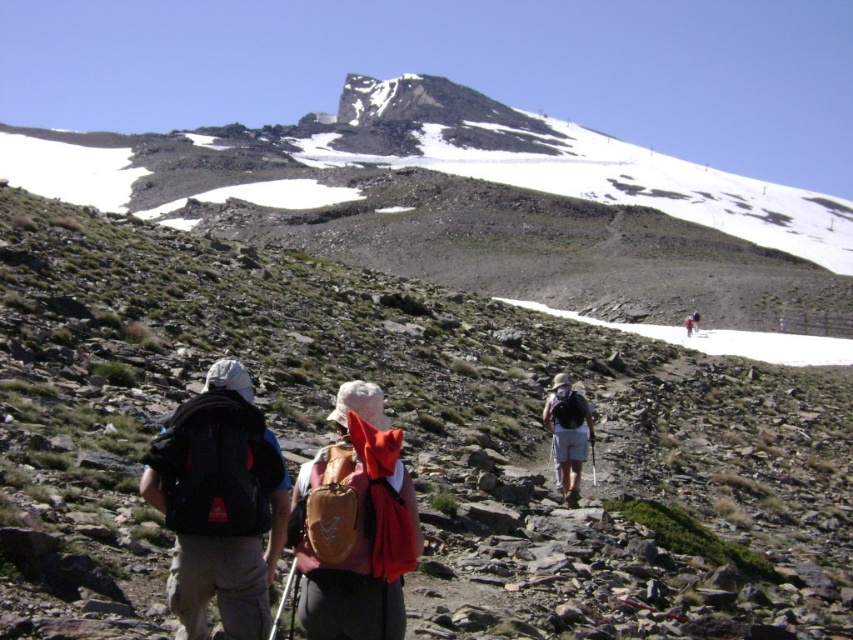
Which of these two, brown fabric backpack at center or matte orange backpack at center, stands shorter?

matte orange backpack at center

Can you confirm if brown fabric backpack at center is positioned below matte orange backpack at center?

No, brown fabric backpack at center is not below matte orange backpack at center.

Is point (312, 612) closer to camera compared to point (573, 404)?

Yes, point (312, 612) is in front of point (573, 404).

The image size is (853, 640). I want to click on brown fabric backpack at center, so click(358, 525).

Which is more to the left, snowy rock at upper center or matte orange backpack at center?

snowy rock at upper center

Is snowy rock at upper center bigger than matte orange backpack at center?

Indeed, snowy rock at upper center has a larger size compared to matte orange backpack at center.

Is point (3, 154) positioned before point (561, 408)?

No, it is not.

Identify the location of snowy rock at upper center. Image resolution: width=853 pixels, height=640 pixels. (477, 205).

Can you confirm if black matte backpack at left is positioned below brown fabric backpack at center?

Incorrect, black matte backpack at left is not positioned below brown fabric backpack at center.

Between black matte backpack at left and brown fabric backpack at center, which one has more height?

brown fabric backpack at center is taller.

Does point (224, 380) lie behind point (397, 586)?

Yes.

Where is `black matte backpack at left`? This screenshot has width=853, height=640. black matte backpack at left is located at coordinates (219, 504).